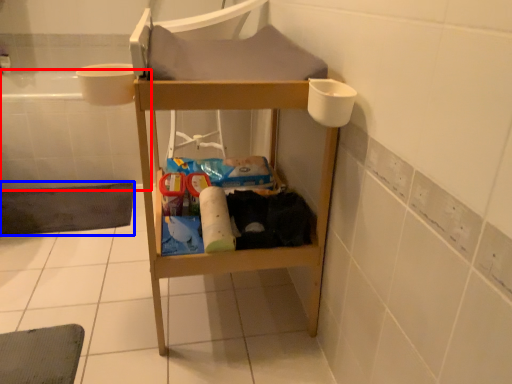
Question: Which point is further to the camera, bath (highlighted by a red box) or bath mat (highlighted by a blue box)?

Choices:
 (A) bath
 (B) bath mat

Answer: (A)